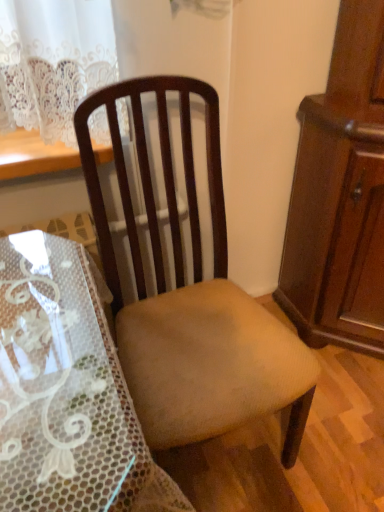
This screenshot has height=512, width=384. What do you see at coordinates (340, 195) in the screenshot? I see `mahogany wood cabinet at right` at bounding box center [340, 195].

The image size is (384, 512). In order to click on mahogany wood cabinet at right in this screenshot , I will do `click(340, 195)`.

What is the approximate height of mahogany wood cabinet at right?

It is 1.15 meters.

At what (x,y) coordinates should I click in order to perform the action: click on wooden chair at center. Please return your answer as a coordinate pair (x, y). The height and width of the screenshot is (512, 384). Looking at the image, I should click on (191, 296).

Image resolution: width=384 pixels, height=512 pixels. Describe the element at coordinates (191, 296) in the screenshot. I see `wooden chair at center` at that location.

Measure the distance between wooden chair at center and camera.

The distance of wooden chair at center from camera is 33.73 inches.

Measure the distance between point (253, 340) and camera.

The depth of point (253, 340) is 1.03 meters.

Locate an element on the screen. The width and height of the screenshot is (384, 512). mahogany wood cabinet at right is located at coordinates (340, 195).

Would you say wooden chair at center is to the left or to the right of mahogany wood cabinet at right in the picture?

wooden chair at center is positioned on mahogany wood cabinet at right's left side.

Does wooden chair at center come in front of mahogany wood cabinet at right?

Result: Yes.

Is point (132, 238) in front of point (374, 71)?

No.

From the image's perspective, is wooden chair at center under mahogany wood cabinet at right?

Yes, from the image's perspective, wooden chair at center is below mahogany wood cabinet at right.

From a real-world perspective, who is located lower, wooden chair at center or mahogany wood cabinet at right?

wooden chair at center is physically lower.

Considering the sizes of objects wooden chair at center and mahogany wood cabinet at right in the image provided, who is wider, wooden chair at center or mahogany wood cabinet at right?

Wider between the two is wooden chair at center.

In terms of height, does wooden chair at center look taller or shorter compared to mahogany wood cabinet at right?

Considering their sizes, wooden chair at center has less height than mahogany wood cabinet at right.

Looking at this image, is wooden chair at center bigger or smaller than mahogany wood cabinet at right?

Considering their sizes, wooden chair at center takes up less space than mahogany wood cabinet at right.

Does wooden chair at center contain mahogany wood cabinet at right?

Actually, mahogany wood cabinet at right is outside wooden chair at center.

Is wooden chair at center next to mahogany wood cabinet at right and touching it?

wooden chair at center and mahogany wood cabinet at right are not in contact.

Is wooden chair at center oriented away from mahogany wood cabinet at right?

No, wooden chair at center is not facing the opposite direction of mahogany wood cabinet at right.

What's the angular difference between wooden chair at center and mahogany wood cabinet at right's facing directions?

The facing directions of wooden chair at center and mahogany wood cabinet at right are 51 degrees apart.

At what (x,y) coordinates should I click in order to perform the action: click on cabinetry that is above the wooden chair at center (from the image's perspective). Please return your answer as a coordinate pair (x, y). Looking at the image, I should click on (340, 195).

Between mahogany wood cabinet at right and wooden chair at center, which one appears on the left side from the viewer's perspective?

wooden chair at center.

Considering the positions of objects mahogany wood cabinet at right and wooden chair at center in the image provided, who is in front, mahogany wood cabinet at right or wooden chair at center?

wooden chair at center is in front.

Which point is more forward, (371, 79) or (177, 300)?

The point (371, 79) is in front.

From the image's perspective, is mahogany wood cabinet at right above wooden chair at center?

Yes, from the image's perspective, mahogany wood cabinet at right is above wooden chair at center.

From a real-world perspective, which object stands above the other?

mahogany wood cabinet at right.

In terms of width, does mahogany wood cabinet at right look wider or thinner when compared to wooden chair at center?

In the image, mahogany wood cabinet at right appears to be more narrow than wooden chair at center.

Which of these two, mahogany wood cabinet at right or wooden chair at center, stands taller?

mahogany wood cabinet at right.

Does mahogany wood cabinet at right have a smaller size compared to wooden chair at center?

No, mahogany wood cabinet at right is not smaller than wooden chair at center.

Consider the image. Choose the correct answer: Is mahogany wood cabinet at right inside wooden chair at center or outside it?

mahogany wood cabinet at right is not inside wooden chair at center, it's outside.

Are mahogany wood cabinet at right and wooden chair at center making contact?

There is a gap between mahogany wood cabinet at right and wooden chair at center.

Is wooden chair at center at the back of mahogany wood cabinet at right?

No.

The image size is (384, 512). What are the coordinates of `cabinetry that appears above the wooden chair at center (from a real-world perspective)` in the screenshot? It's located at [x=340, y=195].

Locate an element on the screen. This screenshot has height=512, width=384. chair below the mahogany wood cabinet at right (from the image's perspective) is located at coordinates (191, 296).

Where is `chair beneath the mahogany wood cabinet at right (from a real-world perspective)`? This screenshot has width=384, height=512. chair beneath the mahogany wood cabinet at right (from a real-world perspective) is located at coordinates (191, 296).